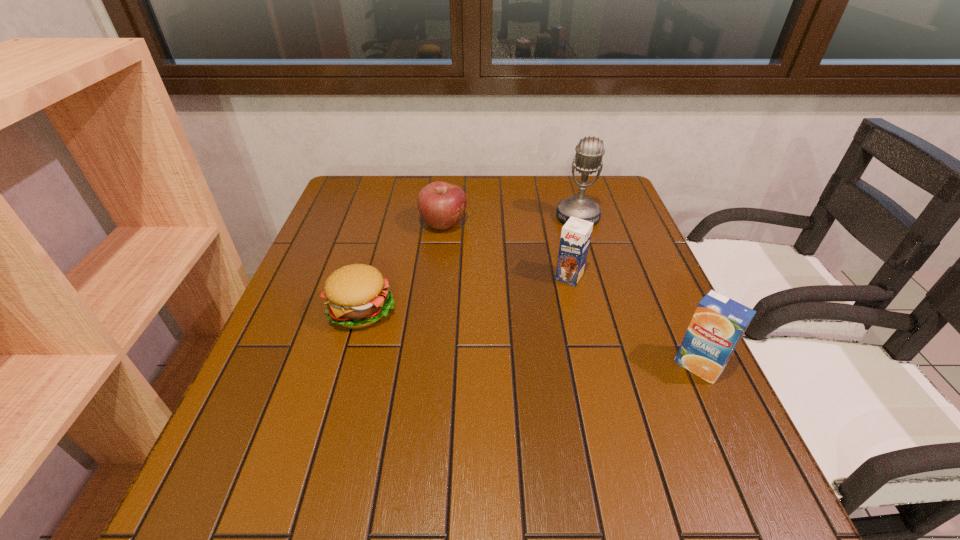
At what (x,y) coordinates should I click in order to perform the action: click on free region located on the front-facing side of the tallest object. Please return your answer as a coordinate pair (x, y). This screenshot has height=540, width=960. Looking at the image, I should click on (567, 289).

The width and height of the screenshot is (960, 540). I want to click on vacant space situated 0.170m on the side of the second object from left to right with the unique marking, so click(x=489, y=269).

Locate an element on the screen. vacant region located on the side of the second object from left to right with the unique marking is located at coordinates (502, 282).

I want to click on vacant space located 0.240m on the side of the second object from left to right with the unique marking, so click(x=504, y=284).

The image size is (960, 540). Find the location of `vacant point located 0.180m on the front label of the chocolate milk`. vacant point located 0.180m on the front label of the chocolate milk is located at coordinates (532, 333).

Find the location of a particular element. free space located on the front label of the chocolate milk is located at coordinates (525, 342).

The image size is (960, 540). Find the location of `vacant area situated on the front label of the chocolate milk`. vacant area situated on the front label of the chocolate milk is located at coordinates (496, 387).

At what (x,y) coordinates should I click in order to perform the action: click on microphone that is at the far edge. Please return your answer as a coordinate pair (x, y). Image resolution: width=960 pixels, height=540 pixels. Looking at the image, I should click on (589, 152).

Find the location of a particular element. apple located in the far edge section of the desktop is located at coordinates (442, 205).

Where is `object located at the left edge`? object located at the left edge is located at coordinates (357, 296).